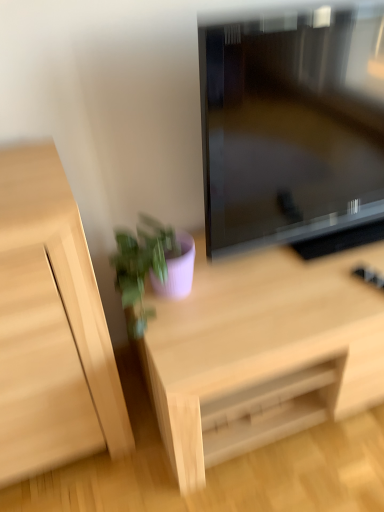
At what (x,y) coordinates should I click in order to perform the action: click on free point in front of matte purple pot at lower center. Please return your answer as a coordinate pair (x, y). This screenshot has height=512, width=384. Looking at the image, I should click on (190, 345).